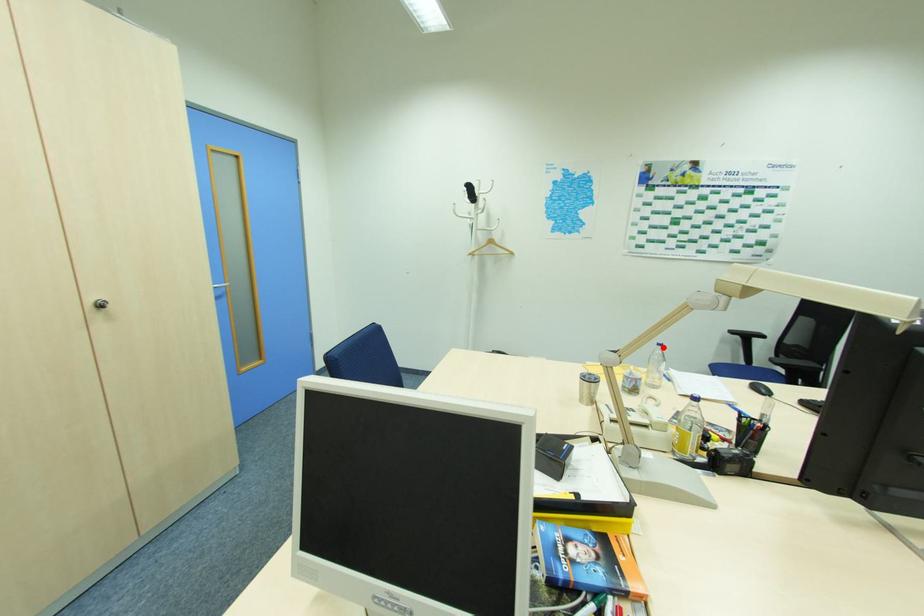
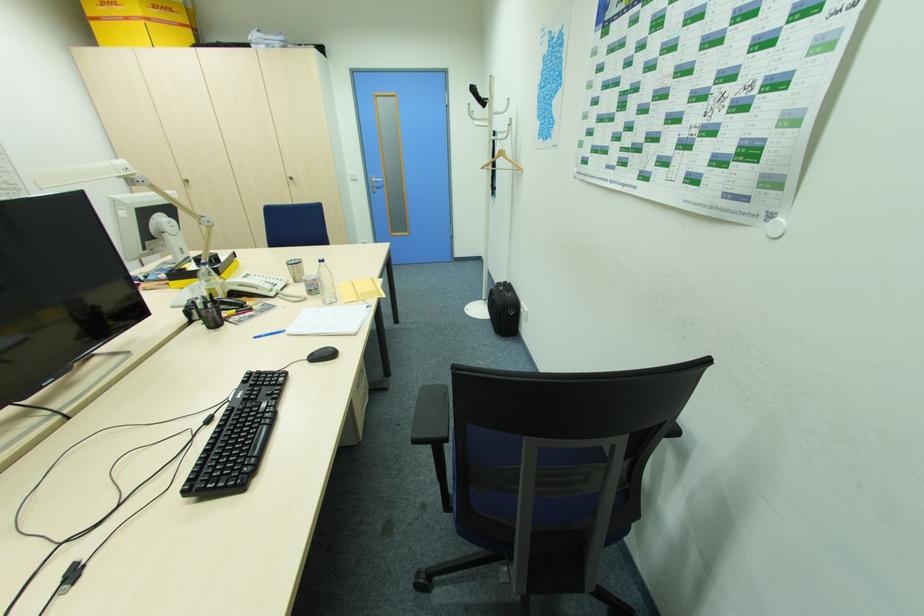
Locate, in the second image, the point that corresponds to the highlighted location in the first image.

(324, 264)